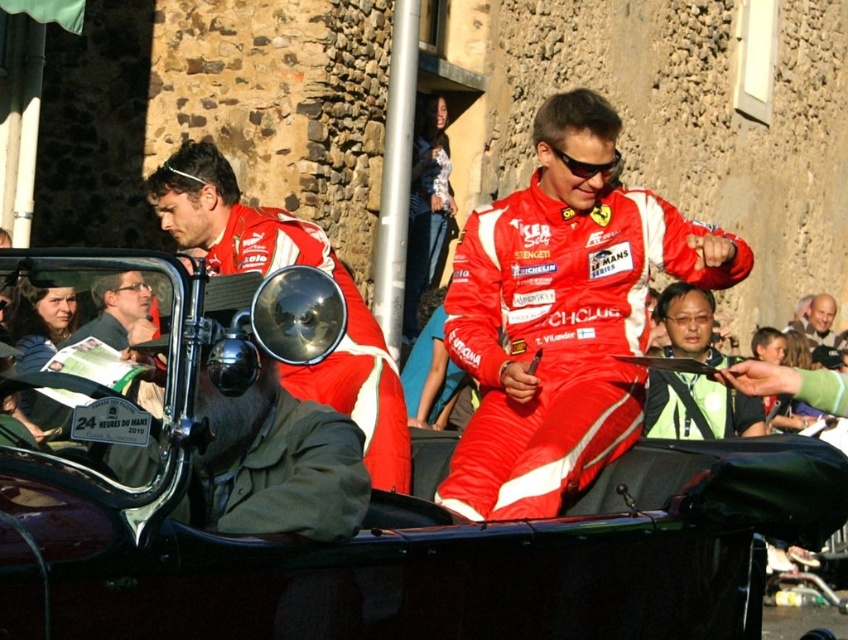
Is shiny black car at center positioned behind matte black jacket at left?

That is False.

Who is positioned more to the right, shiny black car at center or matte black jacket at left?

shiny black car at center is more to the right.

At what (x,y) coordinates should I click in order to perform the action: click on shiny black car at center. Please return your answer as a coordinate pair (x, y). Looking at the image, I should click on (399, 538).

Is point (611, 154) farther from viewer compared to point (695, 372)?

No, it is in front of (695, 372).

Who is more forward, (740,276) or (756,404)?

Positioned in front is point (740,276).

Does point (478, 228) come behind point (668, 420)?

No, (478, 228) is closer to viewer.

You are a GUI agent. You are given a task and a screenshot of the screen. Output one action in this format:
    pyautogui.click(x=<x>, y=<y>)
    Task: Click on the red fabric suit at center
    The height and width of the screenshot is (640, 848).
    Given the screenshot: What is the action you would take?
    pyautogui.click(x=562, y=316)

Which is in front, point (620, 310) or point (121, 296)?

Positioned in front is point (121, 296).

Which of these two, red fabric suit at center or matte black jacket at left, stands taller?

Standing taller between the two is red fabric suit at center.

Who is more forward, (512, 413) or (113, 333)?

Point (113, 333) is in front.

I want to click on red fabric suit at center, so click(562, 316).